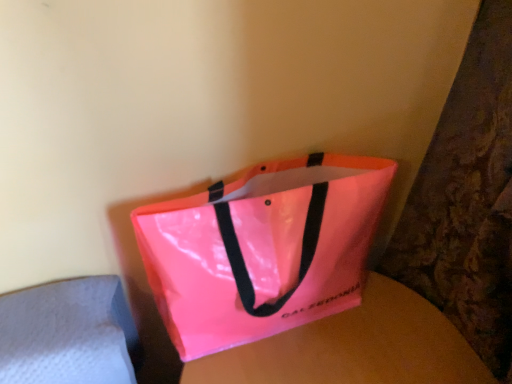
Question: Considering the positions of pink glossy bag at center and neon pink glossy tote bag at center in the image, is pink glossy bag at center bigger or smaller than neon pink glossy tote bag at center?

Choices:
 (A) small
 (B) big

Answer: (B)

Question: Considering the positions of pink glossy bag at center and neon pink glossy tote bag at center in the image, is pink glossy bag at center wider or thinner than neon pink glossy tote bag at center?

Choices:
 (A) wide
 (B) thin

Answer: (A)

Question: Is pink glossy bag at center inside the boundaries of neon pink glossy tote bag at center, or outside?

Choices:
 (A) inside
 (B) outside

Answer: (B)

Question: Does point (275, 188) appear closer or farther from the camera than point (448, 359)?

Choices:
 (A) closer
 (B) farther

Answer: (A)

Question: Considering the relative positions of neon pink glossy tote bag at center and pink glossy bag at center in the image provided, is neon pink glossy tote bag at center to the left or to the right of pink glossy bag at center?

Choices:
 (A) right
 (B) left

Answer: (B)

Question: Looking at their shapes, would you say neon pink glossy tote bag at center is wider or thinner than pink glossy bag at center?

Choices:
 (A) wide
 (B) thin

Answer: (B)

Question: From a real-world perspective, relative to pink glossy bag at center, is neon pink glossy tote bag at center vertically above or below?

Choices:
 (A) above
 (B) below

Answer: (A)